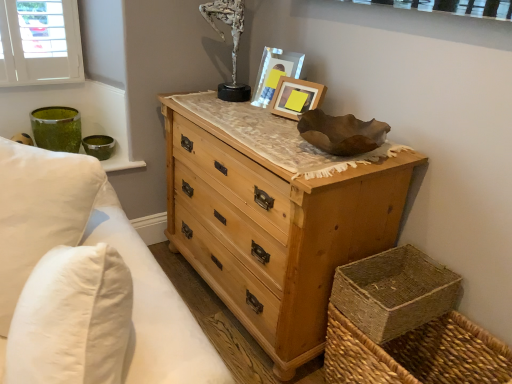
Question: From a real-world perspective, relative to woven natural basket at lower right, is wooden picture frame at upper center, acting as the first picture frame starting from the front, vertically above or below?

Choices:
 (A) above
 (B) below

Answer: (A)

Question: Considering the positions of wooden picture frame at upper center, acting as the first picture frame starting from the front, and woven natural basket at lower right in the image, is wooden picture frame at upper center, acting as the first picture frame starting from the front, wider or thinner than woven natural basket at lower right?

Choices:
 (A) wide
 (B) thin

Answer: (B)

Question: Estimate the real-world distances between objects in this image. Which object is closer to the woven natural basket at lower right?

Choices:
 (A) matte wooden picture frame at upper center, the 1th picture frame when ordered from back to front
 (B) wooden picture frame at upper center, acting as the first picture frame starting from the front
 (C) white cotton pillows at left
 (D) natural wood chest of drawers at center
 (E) woven brown basket at lower right

Answer: (E)

Question: Which object is positioned farthest from the natural wood chest of drawers at center?

Choices:
 (A) white cotton pillows at left
 (B) matte wooden picture frame at upper center, the 1th picture frame when ordered from back to front
 (C) woven brown basket at lower right
 (D) woven natural basket at lower right
 (E) wooden picture frame at upper center, which is counted as the 2th picture frame, starting from the back

Answer: (C)